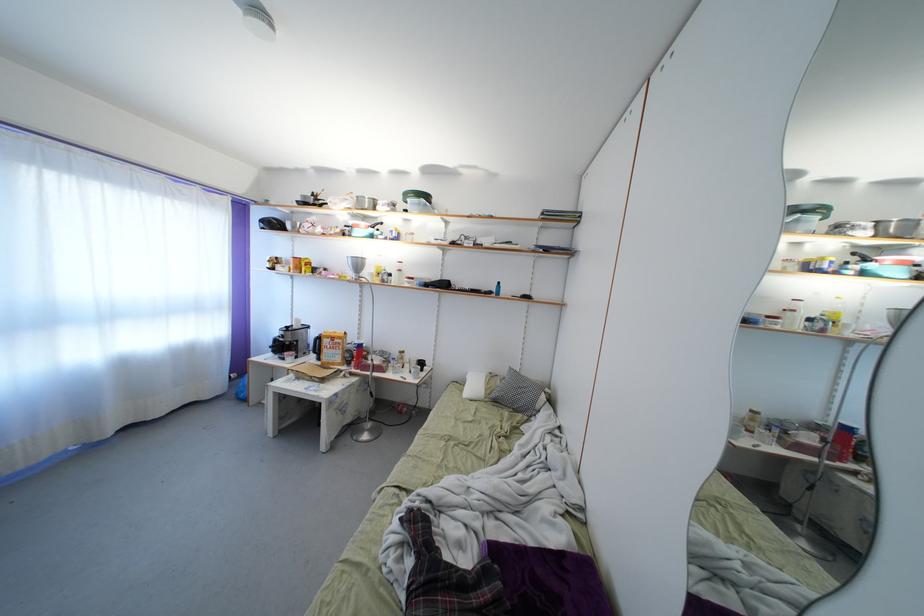
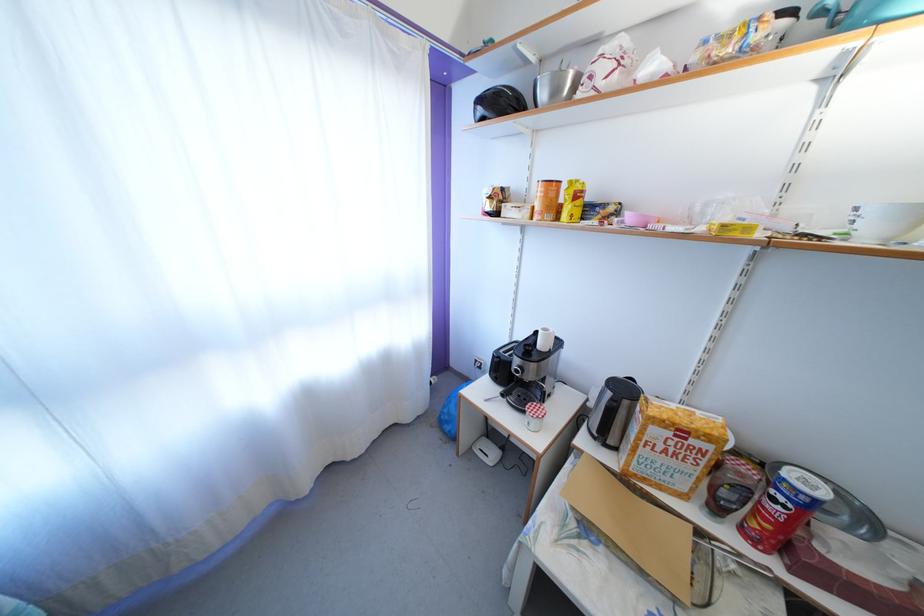
Locate, in the second image, the point that corresponds to [338,341] in the first image.

(688, 428)